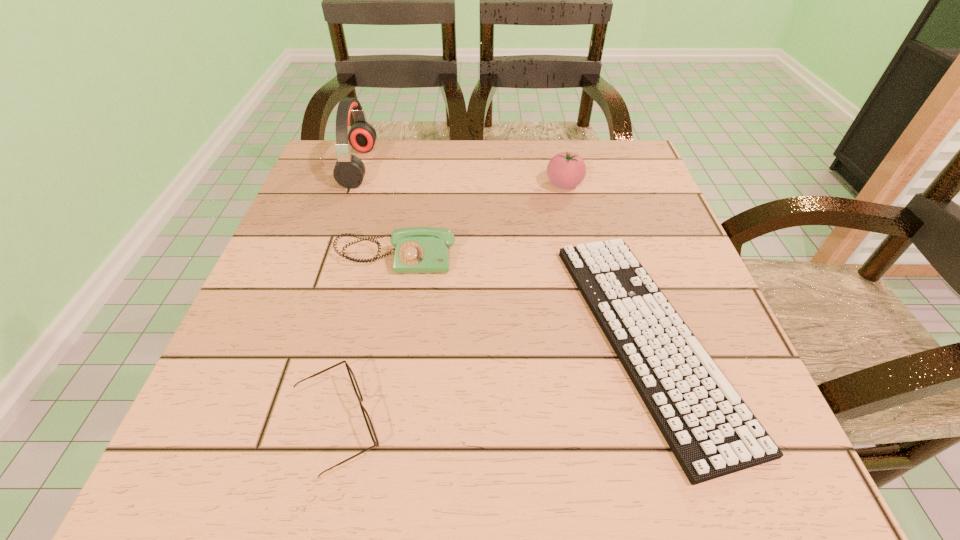
Find the location of a particular element. object positioned at the near left corner is located at coordinates (369, 424).

This screenshot has height=540, width=960. I want to click on object situated at the far right corner, so click(565, 170).

Image resolution: width=960 pixels, height=540 pixels. Find the location of `object at the near right corner`. object at the near right corner is located at coordinates click(711, 431).

Find the location of a particular element. This screenshot has height=540, width=960. vacant space at the far edge of the desktop is located at coordinates (396, 145).

Find the location of `vacant space at the near edge of the desktop`. vacant space at the near edge of the desktop is located at coordinates (308, 477).

Identify the location of vacant space at the left edge of the desktop. (269, 338).

Where is `vacant space at the right edge of the desktop`? The height and width of the screenshot is (540, 960). vacant space at the right edge of the desktop is located at coordinates (662, 279).

In the image, there is a desktop. Where is `vacant space at the far left corner`? vacant space at the far left corner is located at coordinates (367, 161).

Find the location of a particular element. The image size is (960, 540). vacant space at the near left corner of the desktop is located at coordinates (228, 467).

This screenshot has width=960, height=540. I want to click on vacant space at the far right corner, so click(619, 146).